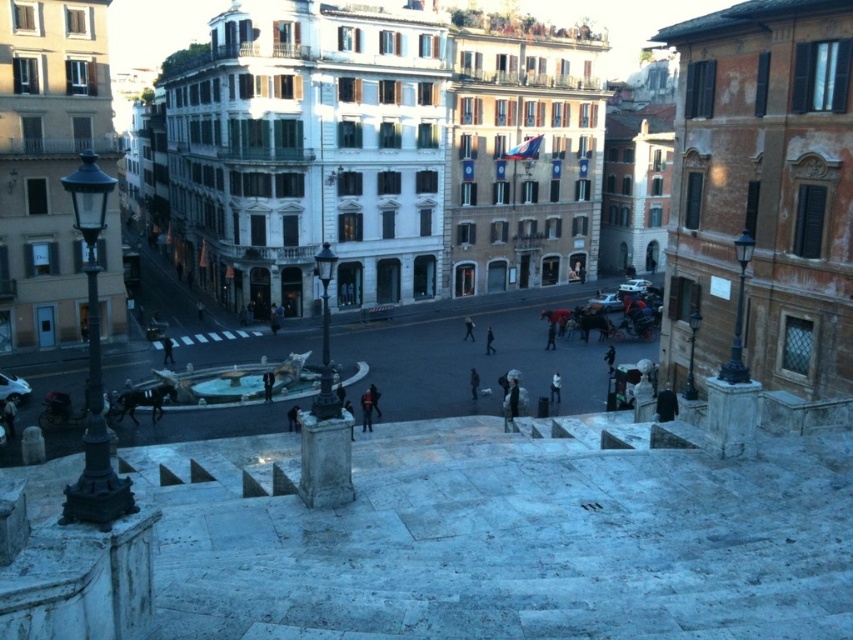
Question: Which of the following is the farthest from the observer?

Choices:
 (A) black fabric person at lower right
 (B) white matte person at center

Answer: (B)

Question: Can you confirm if dark blue fabric at center is positioned above black matte person at center?

Choices:
 (A) yes
 (B) no

Answer: (B)

Question: Which object is the closest to the white matte person at center?

Choices:
 (A) black fabric person at lower right
 (B) dark blue fabric at center
 (C) black matte person at center

Answer: (B)

Question: Does black fabric person at lower right have a greater width compared to black fabric person at center?

Choices:
 (A) yes
 (B) no

Answer: (A)

Question: Which of the following is the farthest from the observer?

Choices:
 (A) black matte person at center
 (B) black fabric person at center
 (C) dark blue jeans at center
 (D) white matte person at center

Answer: (A)

Question: Observing the image, what is the correct spatial positioning of dark blue fabric at center in reference to black fabric person at center?

Choices:
 (A) above
 (B) below

Answer: (B)